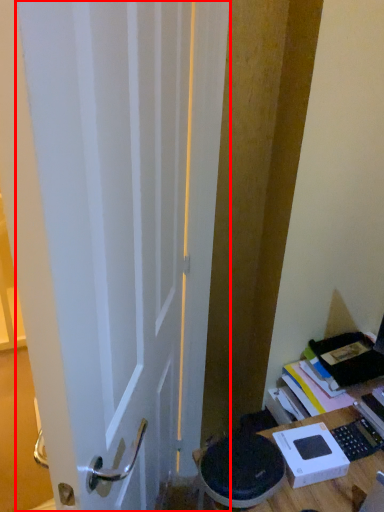
Question: From the image's perspective, where is door (annotated by the red box) located in relation to cardboard box in the image?

Choices:
 (A) above
 (B) below

Answer: (A)